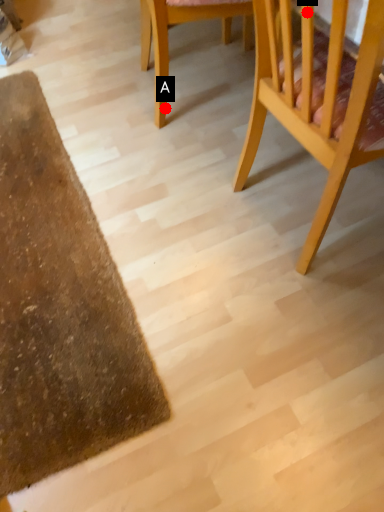
Question: Two points are circled on the image, labeled by A and B beside each circle. Which point is farther to the camera?

Choices:
 (A) A is further
 (B) B is further

Answer: (A)